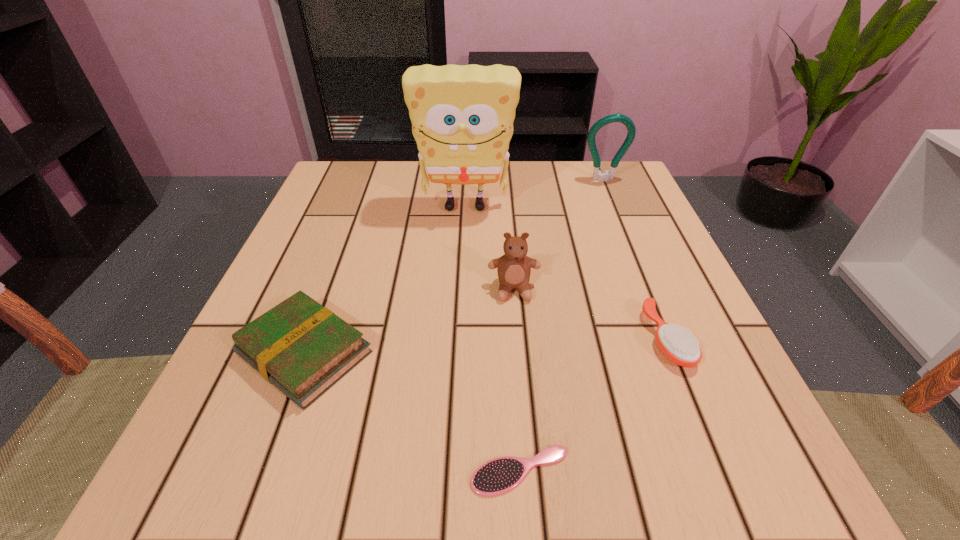
You are a GUI agent. You are given a task and a screenshot of the screen. Output one action in this format:
    pyautogui.click(x=<x>, y=<y>)
    Task: Click on the object present at the left edge
    The height and width of the screenshot is (540, 960).
    Given the screenshot: What is the action you would take?
    pyautogui.click(x=301, y=347)

At what (x,y) coordinates should I click in order to perform the action: click on bottle opener that is at the right edge. Please return your answer as a coordinate pair (x, y). The width and height of the screenshot is (960, 540). Looking at the image, I should click on (597, 174).

Where is `hairbrush at the right edge`? hairbrush at the right edge is located at coordinates click(679, 346).

I want to click on object that is at the far right corner, so click(x=597, y=174).

Find the location of `vacant region at the far edge of the desktop`. vacant region at the far edge of the desktop is located at coordinates (564, 214).

In the image, there is a desktop. Where is `vacant space at the near edge`? The image size is (960, 540). vacant space at the near edge is located at coordinates (396, 454).

In the image, there is a desktop. Where is `free space at the right edge`? The width and height of the screenshot is (960, 540). free space at the right edge is located at coordinates (703, 344).

You are a GUI agent. You are given a task and a screenshot of the screen. Output one action in this format:
    pyautogui.click(x=<x>, y=<y>)
    Task: Click on the free region at the far left corner
    The width and height of the screenshot is (960, 540).
    Given the screenshot: What is the action you would take?
    pyautogui.click(x=349, y=163)

Identify the location of vacant area at the near left corner. The height and width of the screenshot is (540, 960). (200, 450).

Image resolution: width=960 pixels, height=540 pixels. Find the location of `vacant position at the far right corner of the desktop`. vacant position at the far right corner of the desktop is located at coordinates (625, 211).